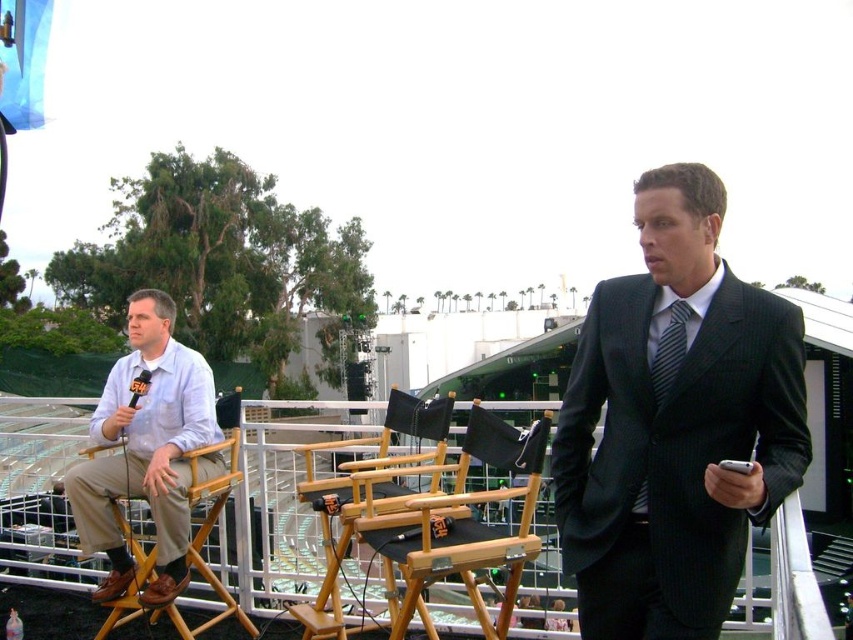
You are standing at the center of the scene and want to greet the person wearing the light blue cotton shirt at left. In which direction should you move to approach them?

The light blue cotton shirt at left is located at point 0.703 on the x axis and 0.171 on the y axis, so you should move to the left to approach them.

You are attending an event and need to locate two attendees based on their clothing. The light blue cotton shirt at left and the dark gray striped tie at center are both present. According to the scene, which clothing item is positioned to the left of the other?

The light blue cotton shirt at left is positioned to the left of the dark gray striped tie at center.